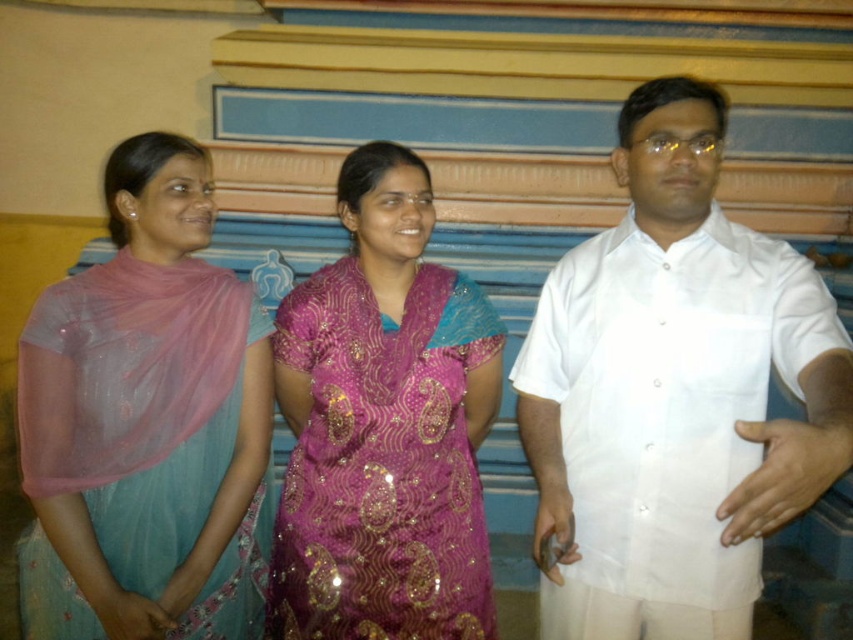
Is point (703, 371) behind point (169, 289)?

That is False.

Who is higher up, white linen shirt at right or light blue silk saree at left?

Positioned higher is white linen shirt at right.

Which is in front, point (805, 458) or point (239, 385)?

Positioned in front is point (805, 458).

This screenshot has width=853, height=640. Find the location of `white linen shirt at right`. white linen shirt at right is located at coordinates (674, 394).

Is light blue silk saree at left bigger than purple sequined dress at center?

Incorrect, light blue silk saree at left is not larger than purple sequined dress at center.

Does light blue silk saree at left have a greater width compared to purple sequined dress at center?

Yes, light blue silk saree at left is wider than purple sequined dress at center.

Locate an element on the screen. The height and width of the screenshot is (640, 853). light blue silk saree at left is located at coordinates (144, 422).

Where is `light blue silk saree at left`? Image resolution: width=853 pixels, height=640 pixels. light blue silk saree at left is located at coordinates (144, 422).

Between white linen shirt at right and purple sequined dress at center, which one is positioned higher?

white linen shirt at right

Who is positioned more to the right, white linen shirt at right or purple sequined dress at center?

Positioned to the right is white linen shirt at right.

What are the coordinates of `white linen shirt at right` in the screenshot? It's located at (674, 394).

At what (x,y) coordinates should I click in order to perform the action: click on white linen shirt at right. Please return your answer as a coordinate pair (x, y). Image resolution: width=853 pixels, height=640 pixels. Looking at the image, I should click on (674, 394).